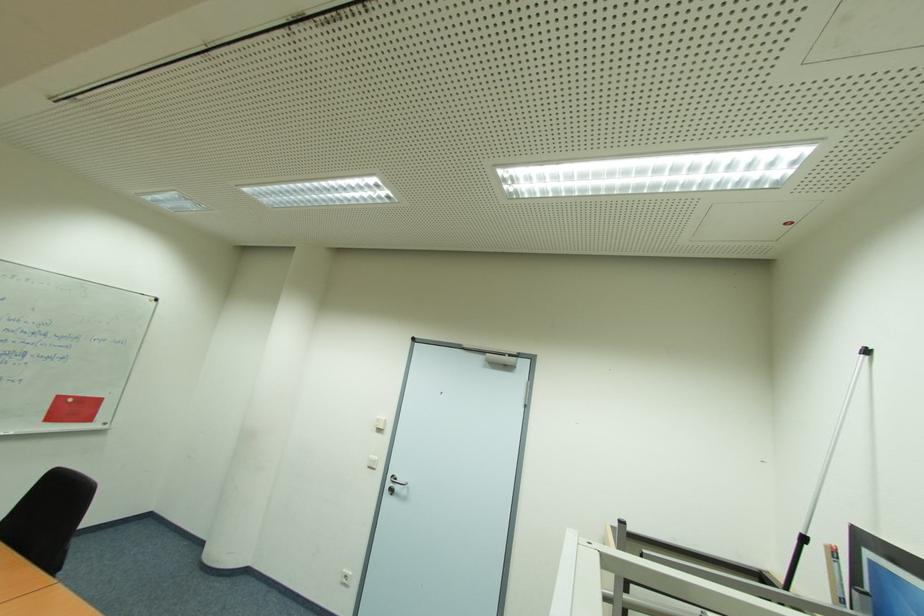
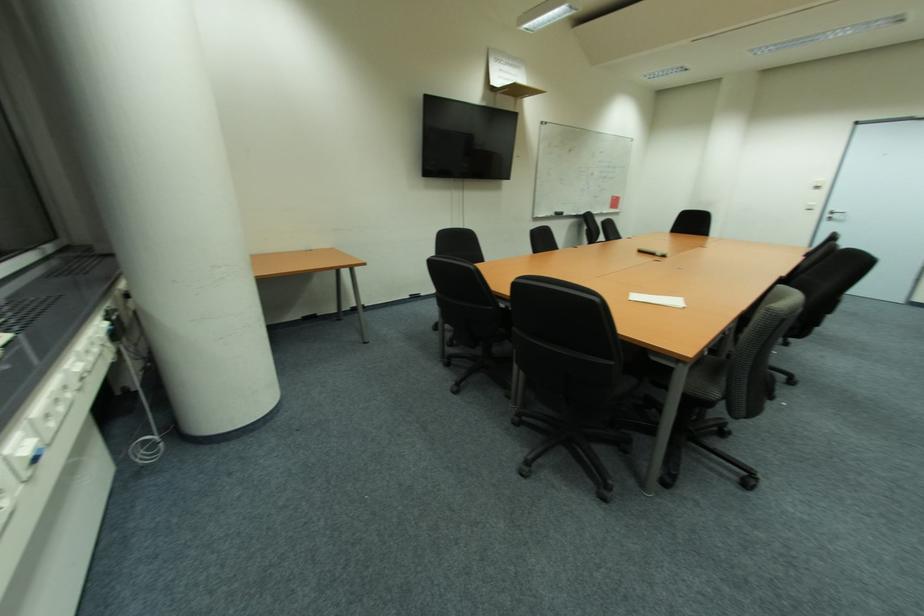
The point at (399, 488) is marked in the first image. Where is the corresponding point in the second image?

(842, 217)